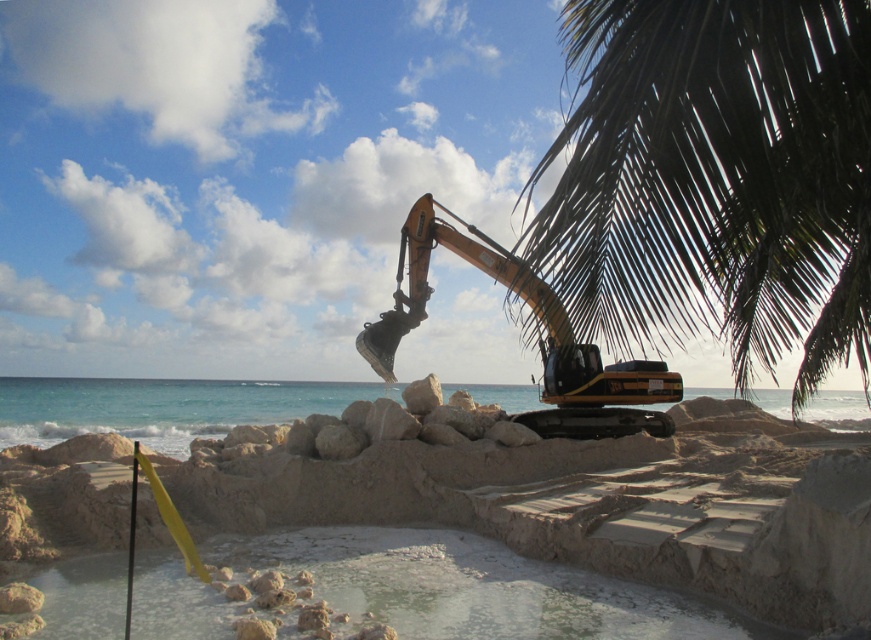
Question: Does smooth sand beach at center have a lesser width compared to yellow metallic excavator at center?

Choices:
 (A) yes
 (B) no

Answer: (B)

Question: Is the position of smooth sand beach at center more distant than that of dark green leafy palm tree at upper right?

Choices:
 (A) yes
 (B) no

Answer: (A)

Question: Which object is closer to the camera taking this photo?

Choices:
 (A) smooth sand beach at center
 (B) yellow metallic excavator at center

Answer: (B)

Question: Which is nearer to the dark green leafy palm tree at upper right?

Choices:
 (A) smooth sand beach at center
 (B) yellow metallic excavator at center

Answer: (B)

Question: Can you confirm if smooth sand beach at center is positioned above dark green leafy palm tree at upper right?

Choices:
 (A) no
 (B) yes

Answer: (A)

Question: Which of the following is the farthest from the observer?

Choices:
 (A) yellow metallic excavator at center
 (B) dark green leafy palm tree at upper right
 (C) smooth sand beach at center

Answer: (C)